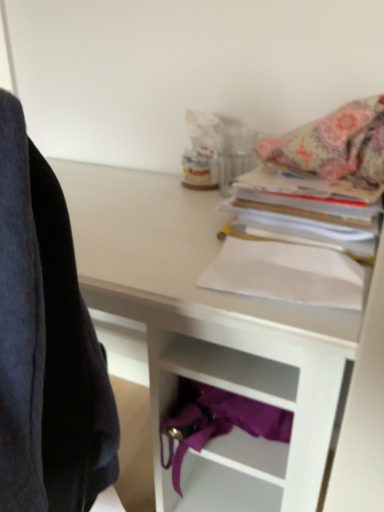
You are a GUI agent. You are given a task and a screenshot of the screen. Output one action in this format:
    pyautogui.click(x=<x>, y=<y>)
    Task: Click on the free region on the left part of white paper at upper right, the second paperback book ordered from the bottom
    
    Given the screenshot: What is the action you would take?
    pyautogui.click(x=158, y=221)